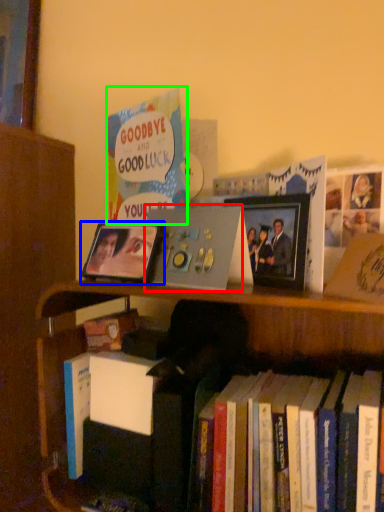
Question: Which is nearer to the paperback book (highlighted by a red box)? picture frame (highlighted by a blue box) or book (highlighted by a green box).

Choices:
 (A) picture frame
 (B) book

Answer: (A)